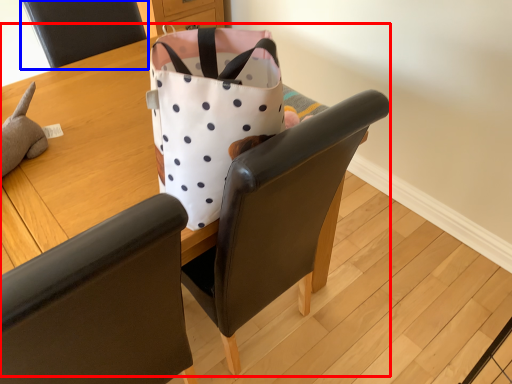
Question: Which point is closer to the camera, table (highlighted by a red box) or chair (highlighted by a blue box)?

Choices:
 (A) table
 (B) chair

Answer: (A)